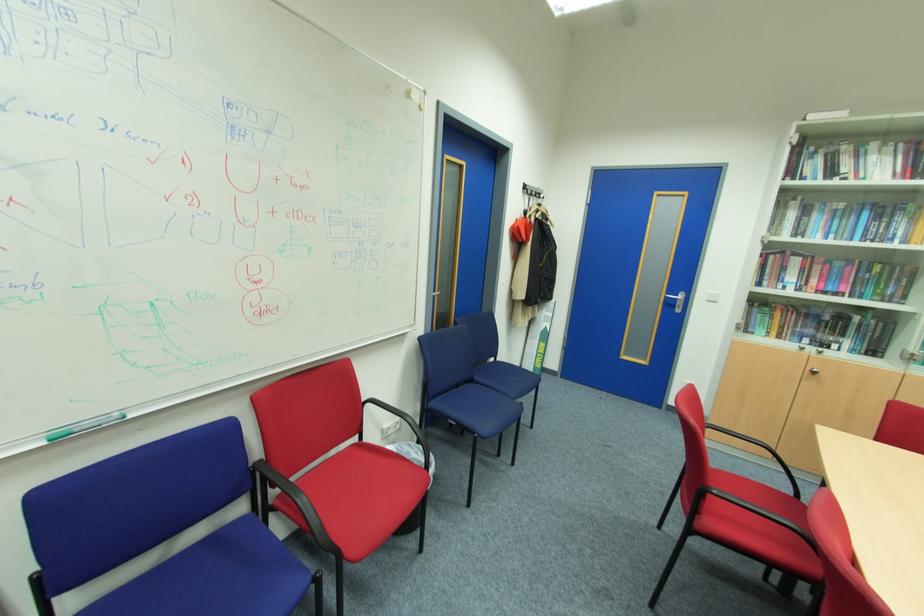
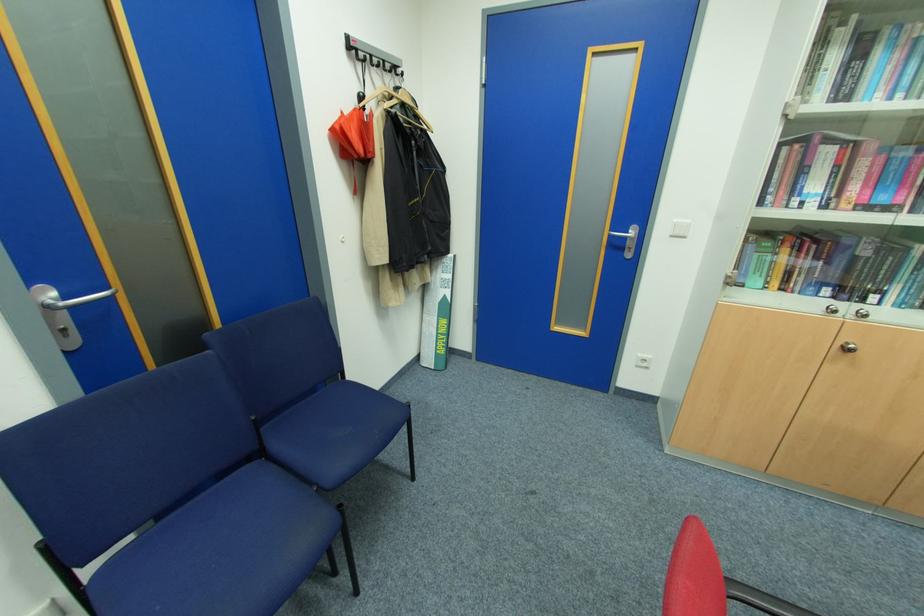
In the second image, find the point that corresponds to point 681,296 in the first image.

(630, 233)